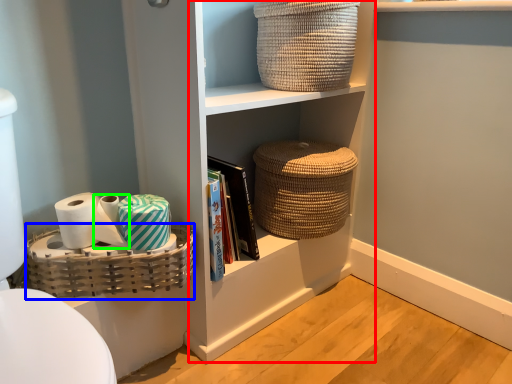
Question: Which is farther away from cabinet (highlighted by a red box)? basket (highlighted by a blue box) or toilet paper (highlighted by a green box)?

Choices:
 (A) basket
 (B) toilet paper

Answer: (B)